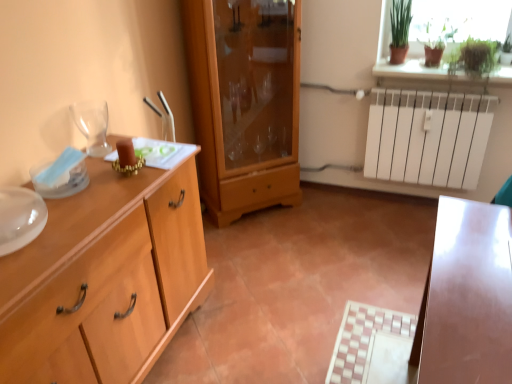
Measure the distance between green matte plant at upper right and camera.

They are 7.30 feet apart.

Locate an element on the screen. Image resolution: width=512 pixels, height=384 pixels. transparent glass wine glass at left is located at coordinates (92, 125).

The width and height of the screenshot is (512, 384). Describe the element at coordinates (92, 125) in the screenshot. I see `transparent glass wine glass at left` at that location.

What do you see at coordinates (105, 278) in the screenshot?
I see `light wood chest of drawers at left` at bounding box center [105, 278].

Locate an element on the screen. This screenshot has height=384, width=512. wooden cabinet at center is located at coordinates (245, 103).

What do you see at coordinates (245, 103) in the screenshot?
I see `wooden cabinet at center` at bounding box center [245, 103].

Find the location of a particular element. The height and width of the screenshot is (384, 512). green matte plant at upper right is located at coordinates (473, 62).

How far apart are light wood chest of drawers at left and green matte plant at upper right?

The distance of light wood chest of drawers at left from green matte plant at upper right is 5.88 feet.

Can you confirm if light wood chest of drawers at left is shorter than green matte plant at upper right?

In fact, light wood chest of drawers at left may be taller than green matte plant at upper right.

In the image, is light wood chest of drawers at left on the left side or the right side of green matte plant at upper right?

Clearly, light wood chest of drawers at left is on the left of green matte plant at upper right in the image.

From a real-world perspective, is light wood chest of drawers at left physically below green matte plant at upper right?

Yes, from a real-world perspective, light wood chest of drawers at left is below green matte plant at upper right.

Is light wood chest of drawers at left not within transparent glass wine glass at left?

Absolutely, light wood chest of drawers at left is external to transparent glass wine glass at left.

Which of these two, light wood chest of drawers at left or transparent glass wine glass at left, is wider?

light wood chest of drawers at left is wider.

Between light wood chest of drawers at left and transparent glass wine glass at left, which one is positioned behind?

transparent glass wine glass at left is more distant.

From the picture: From a real-world perspective, which object rests below the other?

light wood chest of drawers at left is physically lower.

Does wooden cabinet at center turn towards transparent glass wine glass at left?

No, wooden cabinet at center is not oriented towards transparent glass wine glass at left.

Which of these two, wooden cabinet at center or transparent glass wine glass at left, stands taller?

Standing taller between the two is wooden cabinet at center.

In the scene shown: Between wooden cabinet at center and transparent glass wine glass at left, which one has smaller width?

With smaller width is transparent glass wine glass at left.

From a real-world perspective, does wooden cabinet at center sit lower than transparent glass wine glass at left?

Yes.

Considering the sizes of objects green matte plant at upper right and transparent glass wine glass at left in the image provided, who is smaller, green matte plant at upper right or transparent glass wine glass at left?

With smaller size is transparent glass wine glass at left.

Considering the relative sizes of green matte plant at upper right and transparent glass wine glass at left in the image provided, is green matte plant at upper right taller than transparent glass wine glass at left?

Yes, green matte plant at upper right is taller than transparent glass wine glass at left.

From a real-world perspective, does green matte plant at upper right sit lower than transparent glass wine glass at left?

Incorrect, from a real-world perspective, green matte plant at upper right is higher than transparent glass wine glass at left.

Is green matte plant at upper right taller than light wood chest of drawers at left?

No.

From the image's perspective, which is above, green matte plant at upper right or light wood chest of drawers at left?

From the image's view, green matte plant at upper right is above.

Could you tell me if green matte plant at upper right is facing light wood chest of drawers at left?

No, green matte plant at upper right does not turn towards light wood chest of drawers at left.

Can you confirm if green matte plant at upper right is smaller than light wood chest of drawers at left?

Yes, green matte plant at upper right is smaller than light wood chest of drawers at left.

Which of these two, wooden cabinet at center or green matte plant at upper right, stands shorter?

green matte plant at upper right.

Between wooden cabinet at center and green matte plant at upper right, which one has larger size?

Bigger between the two is wooden cabinet at center.

Is wooden cabinet at center inside or outside of green matte plant at upper right?

wooden cabinet at center is outside green matte plant at upper right.

Is wooden cabinet at center positioned far away from green matte plant at upper right?

wooden cabinet at center is far away from green matte plant at upper right.

Is point (478, 80) closer to viewer compared to point (263, 96)?

Yes, point (478, 80) is in front of point (263, 96).

From the image's perspective, would you say green matte plant at upper right is positioned over wooden cabinet at center?

Yes, from the image's perspective, green matte plant at upper right is above wooden cabinet at center.

Is green matte plant at upper right turned away from wooden cabinet at center?

That's not correct — green matte plant at upper right is not looking away from wooden cabinet at center.

Is green matte plant at upper right spatially inside wooden cabinet at center, or outside of it?

green matte plant at upper right cannot be found inside wooden cabinet at center.

Where is `plant above the light wood chest of drawers at left (from the image's perspective)`? This screenshot has width=512, height=384. plant above the light wood chest of drawers at left (from the image's perspective) is located at coordinates (473, 62).

Where is `wine glass on the left side of light wood chest of drawers at left`? The width and height of the screenshot is (512, 384). wine glass on the left side of light wood chest of drawers at left is located at coordinates (92, 125).

Based on their spatial positions, is green matte plant at upper right or wooden cabinet at center closer to light wood chest of drawers at left?

Among the two, wooden cabinet at center is located nearer to light wood chest of drawers at left.

When comparing their distances from wooden cabinet at center, does light wood chest of drawers at left or green matte plant at upper right seem further?

The object further to wooden cabinet at center is green matte plant at upper right.

From the picture: Which object lies nearer to the anchor point light wood chest of drawers at left, transparent glass wine glass at left or green glass vase at upper right?

transparent glass wine glass at left is positioned closer to the anchor light wood chest of drawers at left.

From the image, which object appears to be farther from wooden cabinet at center, transparent glass wine glass at left or green matte plant at upper right?

Based on the image, green matte plant at upper right appears to be further to wooden cabinet at center.

Based on the photo, looking at the image, which one is located closer to wooden cabinet at center, green matte plant at upper right or light wood chest of drawers at left?

light wood chest of drawers at left lies closer to wooden cabinet at center than the other object.

Which object lies nearer to the anchor point transparent glass wine glass at left, green matte plant at upper right or light wood chest of drawers at left?

light wood chest of drawers at left.

Considering their positions, is wooden cabinet at center positioned closer to light wood chest of drawers at left than green glass vase at upper right?

Among the two, wooden cabinet at center is located nearer to light wood chest of drawers at left.

From the image, which object appears to be farther from transparent glass wine glass at left, wooden cabinet at center or green matte plant at upper right?

Based on the image, green matte plant at upper right appears to be further to transparent glass wine glass at left.

The image size is (512, 384). I want to click on cupboard between transparent glass wine glass at left and green matte plant at upper right in the horizontal direction, so click(245, 103).

This screenshot has height=384, width=512. I want to click on the chest of drawers situated between transparent glass wine glass at left and green matte plant at upper right from left to right, so click(105, 278).

You are a GUI agent. You are given a task and a screenshot of the screen. Output one action in this format:
    pyautogui.click(x=<x>, y=<y>)
    Task: Click on the chest of drawers situated between transparent glass wine glass at left and green glass vase at upper right from left to right
    
    Given the screenshot: What is the action you would take?
    pyautogui.click(x=105, y=278)

Locate an element on the screen. The height and width of the screenshot is (384, 512). cupboard situated between light wood chest of drawers at left and green glass vase at upper right from left to right is located at coordinates (245, 103).